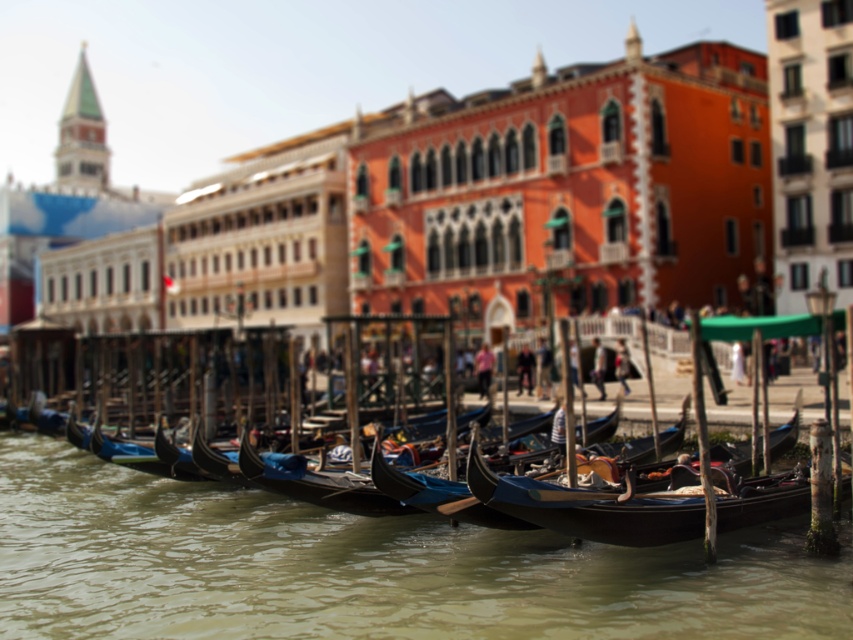
You are standing on the walkway and want to take a photo of the shiny black gondola at center without the greenish water at lower center appearing in the frame. Is this possible given their positions?

The greenish water at lower center is closer to the viewer than the shiny black gondola at center, so it would block the view of the gondola. Therefore, it is not possible to take a photo of the shiny black gondola at center without the greenish water at lower center appearing in the frame.